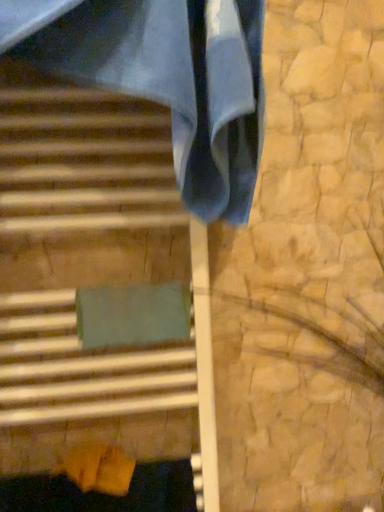
This screenshot has height=512, width=384. What do you see at coordinates (95, 282) in the screenshot? I see `matte green cushion at center` at bounding box center [95, 282].

This screenshot has width=384, height=512. In order to click on matte green cushion at center in this screenshot , I will do `click(95, 282)`.

Find the location of a particular element. This screenshot has width=384, height=512. matte green cushion at center is located at coordinates (95, 282).